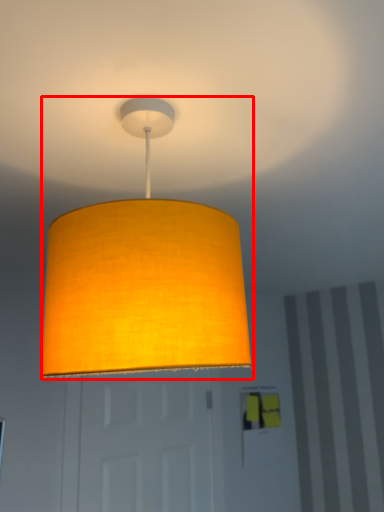
Question: In this image, where is lamp (annotated by the red box) located relative to door?

Choices:
 (A) left
 (B) right

Answer: (B)